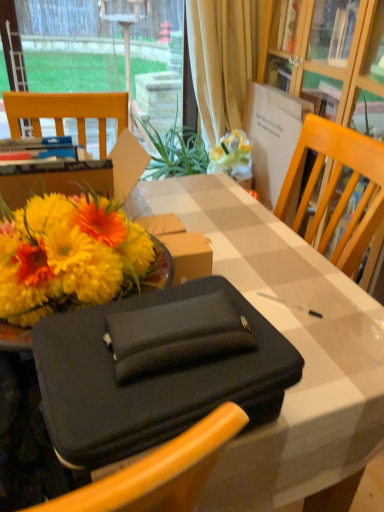
Question: From the image's perspective, is transparent glass window at upper left located above or below black fabric briefcase at center?

Choices:
 (A) below
 (B) above

Answer: (B)

Question: In terms of width, does transparent glass window at upper left look wider or thinner when compared to black fabric briefcase at center?

Choices:
 (A) thin
 (B) wide

Answer: (A)

Question: Estimate the real-world distances between objects in this image. Which object is closer to the black fabric briefcase at center?

Choices:
 (A) beige fabric curtain at upper center
 (B) transparent glass window at upper left

Answer: (A)

Question: Based on their relative distances, which object is farther from the transparent glass window at upper left?

Choices:
 (A) beige fabric curtain at upper center
 (B) black fabric briefcase at center

Answer: (B)